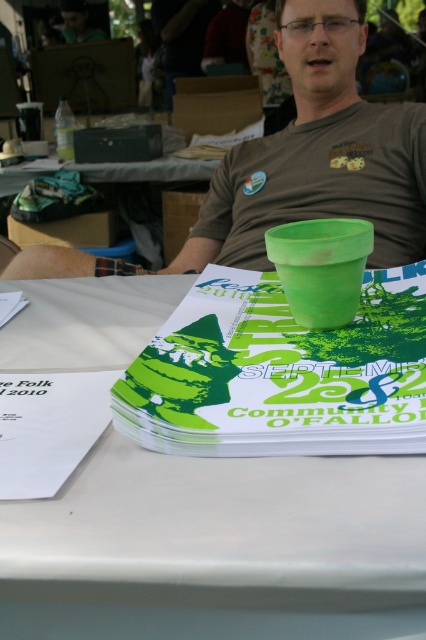
Which is above, matte green pot at upper center or transparent plastic glasses at center?

transparent plastic glasses at center is higher up.

Is matte green pot at upper center below transparent plastic glasses at center?

Yes.

I want to click on matte green pot at upper center, so click(319, 164).

This screenshot has height=640, width=426. In order to click on matte green pot at upper center in this screenshot , I will do `click(319, 164)`.

Is green paper at center above transparent plastic glasses at center?

Actually, green paper at center is below transparent plastic glasses at center.

Which is above, green paper at center or transparent plastic glasses at center?

transparent plastic glasses at center is higher up.

Where is `green paper at center`? green paper at center is located at coordinates (279, 372).

Locate an element on the screen. Image resolution: width=426 pixels, height=640 pixels. green paper at center is located at coordinates (279, 372).

Which is below, white paper at center or green paper at center?

white paper at center is below.

Locate an element on the screen. Image resolution: width=426 pixels, height=640 pixels. white paper at center is located at coordinates click(x=218, y=548).

Where is `white paper at center`? white paper at center is located at coordinates (218, 548).

Identify the location of white paper at center. Image resolution: width=426 pixels, height=640 pixels. (218, 548).